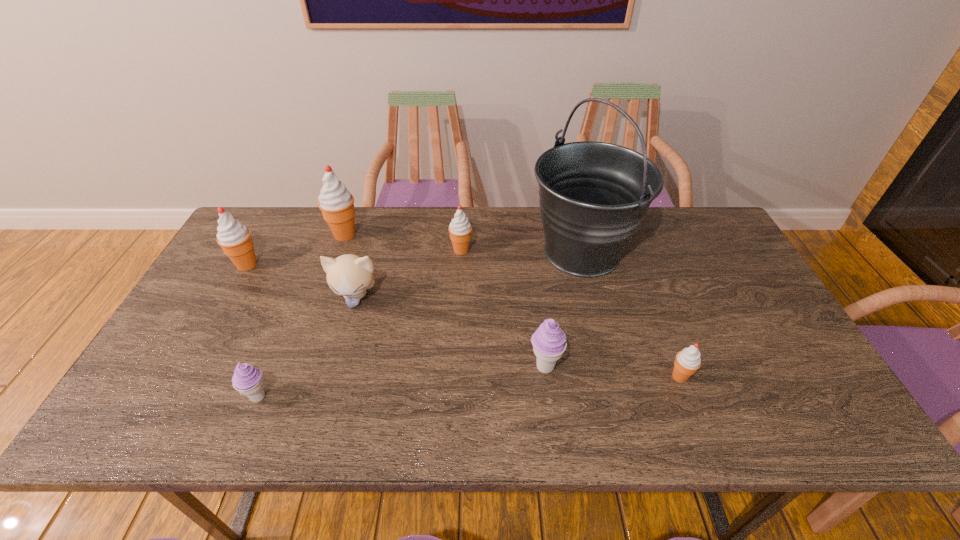
At what (x,y) coordinates should I click in order to perform the action: click on free space at the near left corner. Please return your answer as a coordinate pair (x, y). This screenshot has width=960, height=540. Looking at the image, I should click on (135, 401).

Identify the location of blank region between the right purple icecream and the left purple icecream. Image resolution: width=960 pixels, height=540 pixels. (401, 382).

Find the location of a particular element. This screenshot has height=540, width=960. vacant point located between the smallest red icecream and the second smallest red icecream is located at coordinates point(570,313).

Locate an element on the screen. The image size is (960, 540). free space that is in between the tallest icecream and the right purple icecream is located at coordinates (444, 301).

I want to click on free space that is in between the left purple icecream and the second red icecream from left to right, so click(301, 316).

This screenshot has height=540, width=960. What are the coordinates of `vacant area between the smallest red icecream and the left purple icecream` in the screenshot? It's located at point(469,387).

Image resolution: width=960 pixels, height=540 pixels. I want to click on vacant area that lies between the biggest red icecream and the rightmost icecream, so click(513, 306).

Where is `vacant space that's between the second tallest icecream and the kitten`? The image size is (960, 540). vacant space that's between the second tallest icecream and the kitten is located at coordinates (301, 281).

The height and width of the screenshot is (540, 960). What are the coordinates of `object that is the second closest to the kitten` in the screenshot? It's located at (460, 228).

Locate which object ranks fifth in proximity to the rightmost red icecream. Please provide its 2D coordinates. Your answer should be formatted as a tuple, i.e. [(x, y)], where the tuple contains the x and y coordinates of a point satisfying the conditions above.

[(247, 379)]